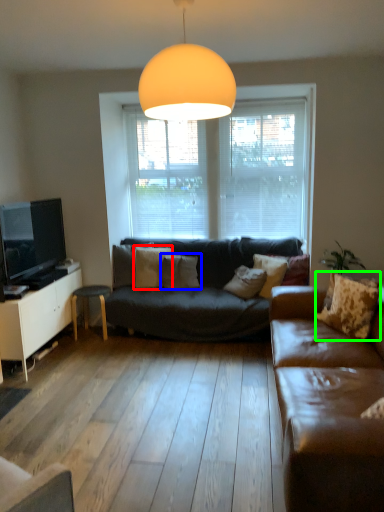
Question: Which object is positioned farthest from pillow (highlighted by a red box)? Select from pillow (highlighted by a blue box) and pillow (highlighted by a green box).

Choices:
 (A) pillow
 (B) pillow

Answer: (B)